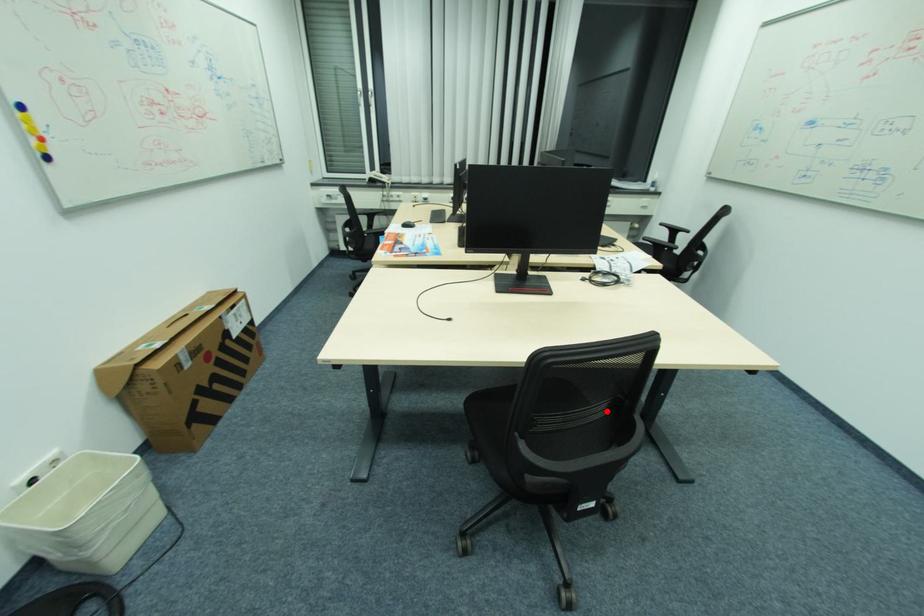
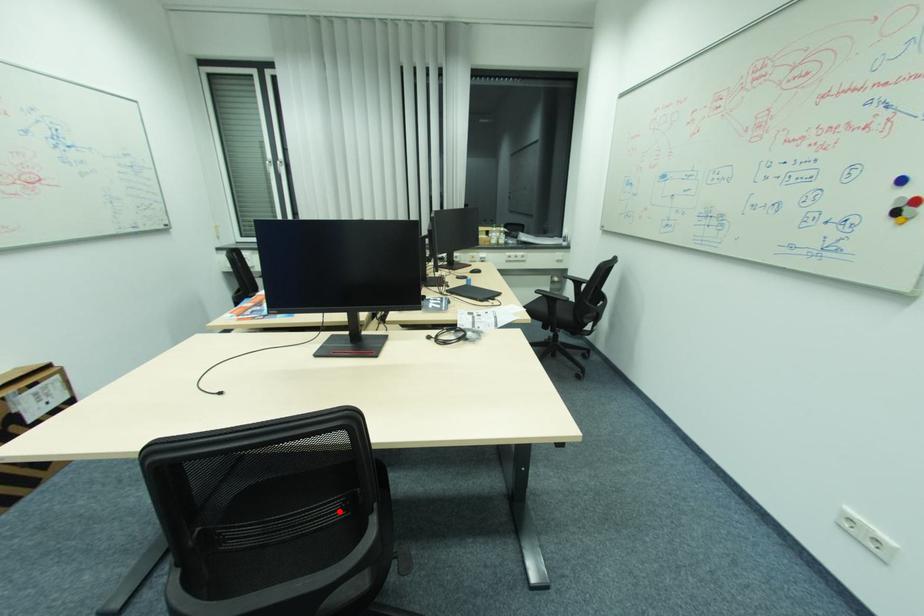
I am providing you with two images of the same scene from different viewpoints. A red point is marked on the first image and another point is marked on the second image. Is the marked point in image1 the same physical position as the marked point in image2?

Yes